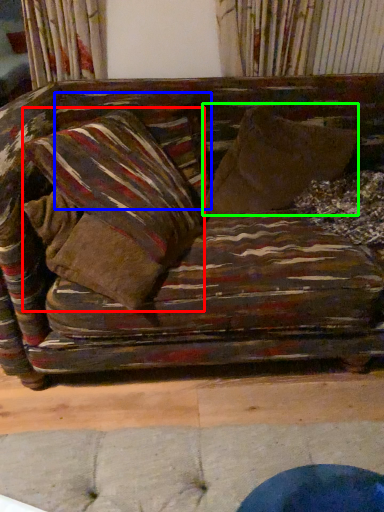
Question: Considering the real-world distances, which object is closest to pillow (highlighted by a red box)? pillow (highlighted by a blue box) or throw pillow (highlighted by a green box).

Choices:
 (A) pillow
 (B) throw pillow

Answer: (A)